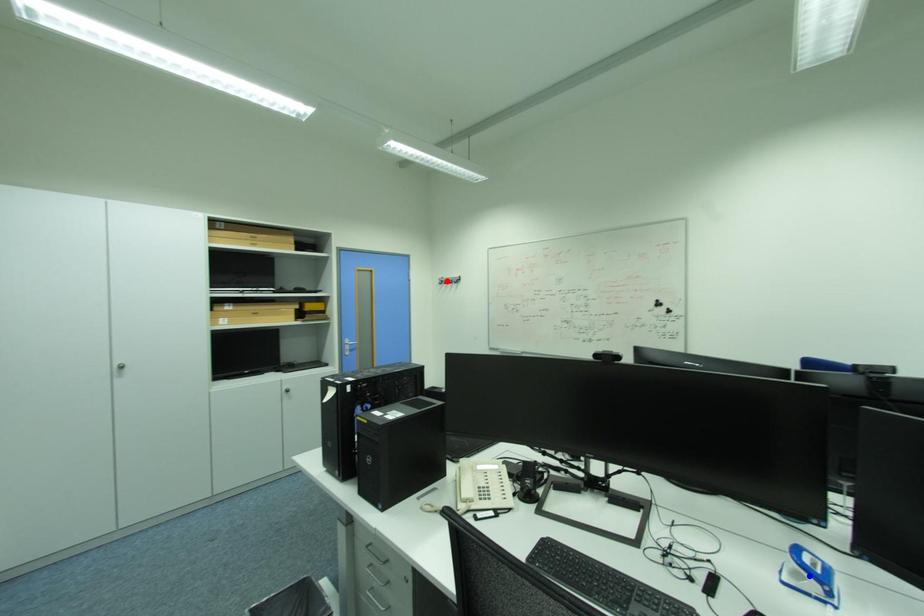
Question: In the image, two points are highlighted. Which point is nearer to the camera? Reply with the corresponding letter.

Choices:
 (A) blue point
 (B) red point

Answer: (A)